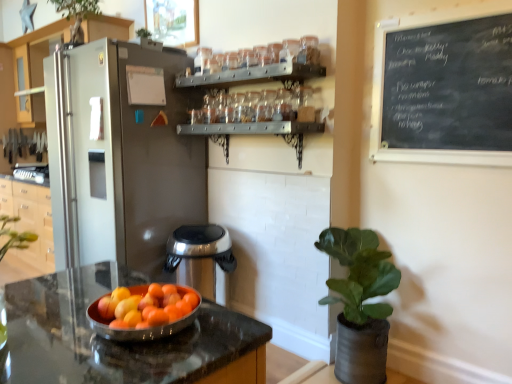
Question: Is satin silver refrigerator at left outside clear glass jars at upper center?

Choices:
 (A) yes
 (B) no

Answer: (A)

Question: Is satin silver refrigerator at left positioned with its back to clear glass jars at upper center?

Choices:
 (A) yes
 (B) no

Answer: (B)

Question: From the image's perspective, is satin silver refrigerator at left located above clear glass jars at upper center?

Choices:
 (A) no
 (B) yes

Answer: (A)

Question: Considering the relative positions of satin silver refrigerator at left and clear glass jars at upper center in the image provided, is satin silver refrigerator at left behind clear glass jars at upper center?

Choices:
 (A) yes
 (B) no

Answer: (A)

Question: Can you confirm if satin silver refrigerator at left is bigger than clear glass jars at upper center?

Choices:
 (A) no
 (B) yes

Answer: (B)

Question: In terms of height, does shiny metallic bowl at center look taller or shorter compared to green leafy plant at upper center?

Choices:
 (A) tall
 (B) short

Answer: (B)

Question: Looking at the image, does shiny metallic bowl at center seem bigger or smaller compared to green leafy plant at upper center?

Choices:
 (A) big
 (B) small

Answer: (B)

Question: In terms of width, does shiny metallic bowl at center look wider or thinner when compared to green leafy plant at upper center?

Choices:
 (A) thin
 (B) wide

Answer: (A)

Question: Considering the positions of point (133, 340) and point (58, 1), is point (133, 340) closer or farther from the camera than point (58, 1)?

Choices:
 (A) farther
 (B) closer

Answer: (B)

Question: Is black chalkboard at upper right situated inside green leafy plant at upper center or outside?

Choices:
 (A) outside
 (B) inside

Answer: (A)

Question: Based on their sizes in the image, would you say black chalkboard at upper right is bigger or smaller than green leafy plant at upper center?

Choices:
 (A) small
 (B) big

Answer: (A)

Question: In terms of height, does black chalkboard at upper right look taller or shorter compared to green leafy plant at upper center?

Choices:
 (A) tall
 (B) short

Answer: (A)

Question: Is black chalkboard at upper right wider or thinner than green leafy plant at upper center?

Choices:
 (A) thin
 (B) wide

Answer: (A)

Question: Which is correct: green leafy plant at upper center is inside black chalkboard at upper right, or outside of it?

Choices:
 (A) outside
 (B) inside

Answer: (A)

Question: Is green leafy plant at upper center wider or thinner than black chalkboard at upper right?

Choices:
 (A) wide
 (B) thin

Answer: (A)